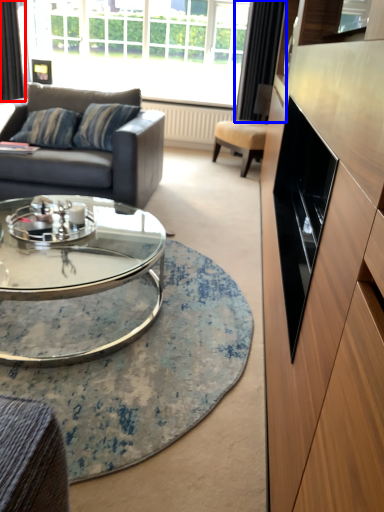
Question: Which point is closer to the camera, curtain (highlighted by a red box) or curtain (highlighted by a blue box)?

Choices:
 (A) curtain
 (B) curtain

Answer: (B)